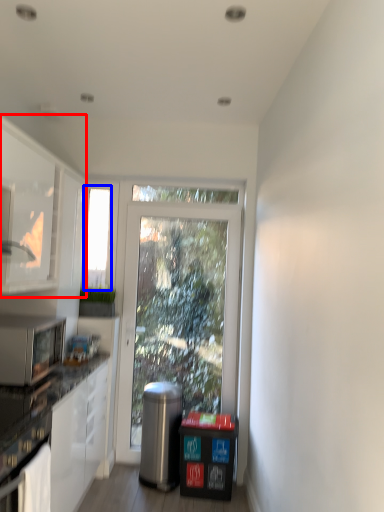
Question: Which point is closer to the camera, cabinetry (highlighted by a red box) or window screen (highlighted by a blue box)?

Choices:
 (A) cabinetry
 (B) window screen

Answer: (A)